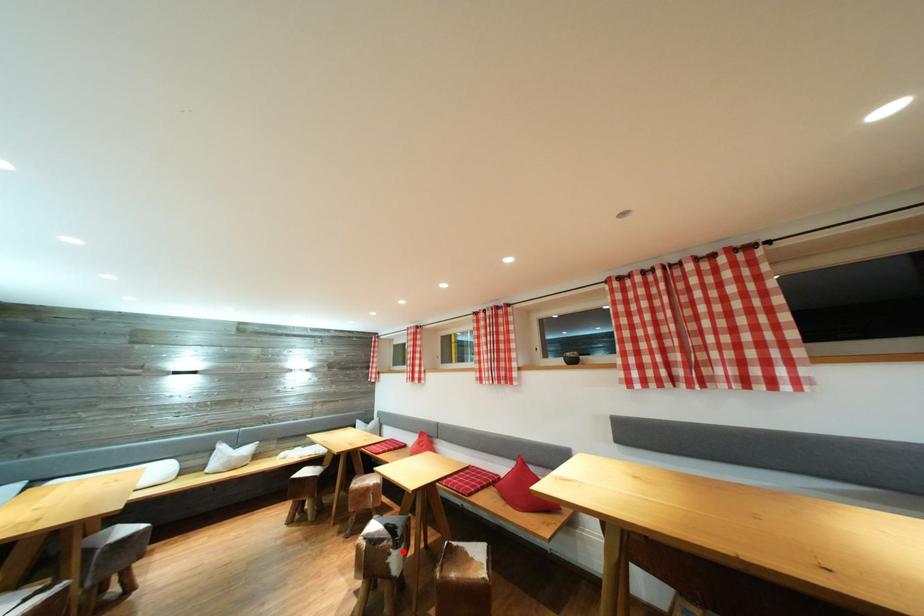
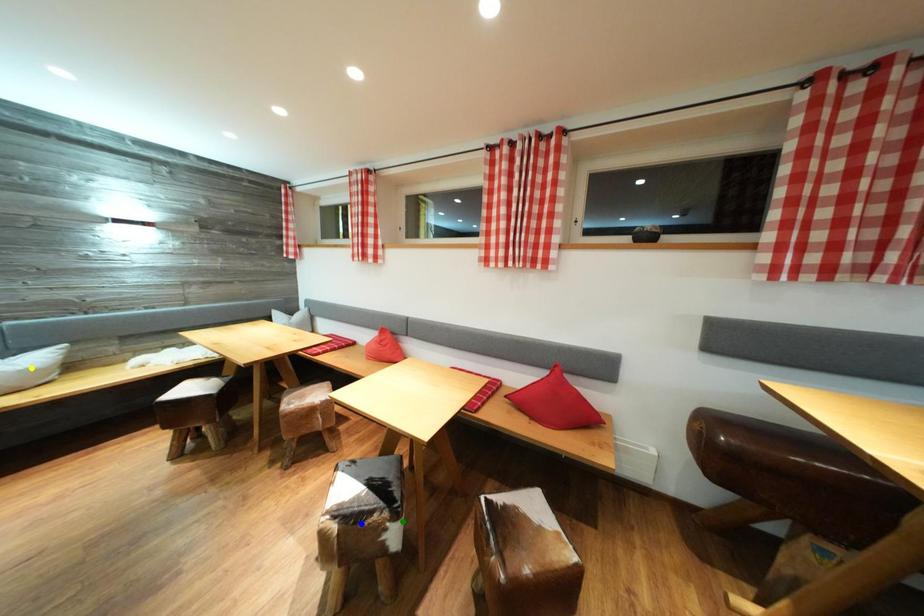
Question: I am providing you with two images of the same scene from different viewpoints. A red point is marked on the first image. You are given multiple points on the second image. Which mark in image 2 goes with the point in image 1?

Choices:
 (A) yellow point
 (B) green point
 (C) blue point

Answer: (B)